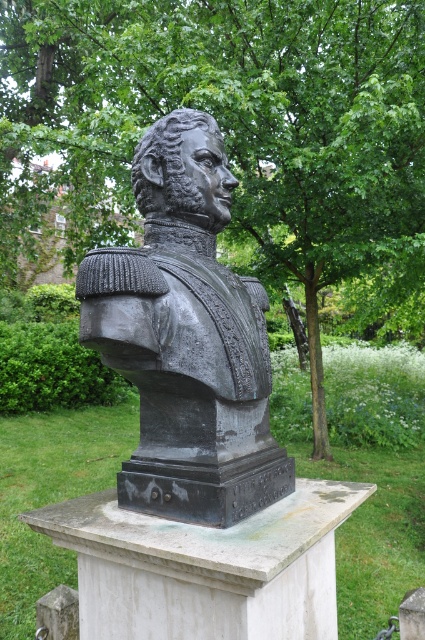
You are standing in the park and want to take a photo of the bronze bust of a historical figure. The camera you are using has a focal length of 50mm and you want to ensure that the entire bust fits within the frame. The recommended minimum distance for photographing such statues is 7 meters to avoid distortion. Is the point at coordinates point (317,115) within the safe distance for taking this photo?

The distance of point (317,115) from the viewer is 8.27 meters, which is beyond the recommended minimum distance of 7 meters. Therefore, the point at coordinates point (317,115) is within the safe distance for taking the photo without distortion.

You are a landscape architect designing a new park layout. You need to place a statue and a tree in such a way that the tree does not overshadow the statue. Given the current arrangement, does the green leafy tree at center cast a shadow over the black polished bust at center?

The green leafy tree at center is not as tall as the black polished bust at center, so it would not cast a shadow over the black polished bust at center.

You are a park visitor standing in front of the black polished bust at center. To your left, there is a path leading towards the green leafy tree at center. If you want to reach the tree without walking around the pedestal, can you directly walk towards it from your current position?

The green leafy tree at center is to the right of the black polished bust at center, so if you are standing in front of the black polished bust at center and the tree is to your right, you would need to walk towards your right to reach it. Since the path leads towards the tree on your left, you might need to adjust your direction or walk around the pedestal to reach it directly.